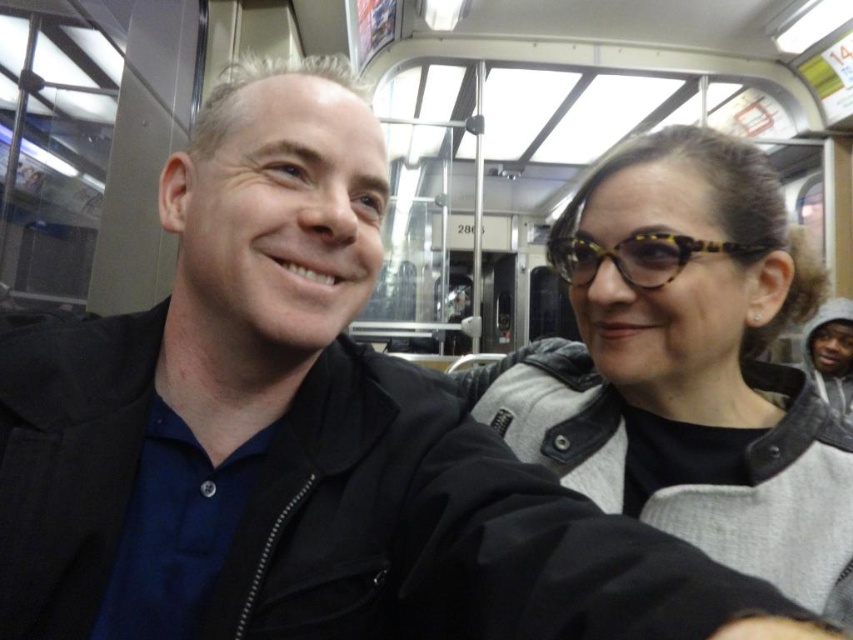
Consider the image. Can you confirm if matte black jacket at center is shorter than tortoiseshell acetate goggles at upper right?

No.

Which is behind, point (729, 324) or point (602, 244)?

The point (729, 324) is more distant.

Locate an element on the screen. This screenshot has width=853, height=640. matte black jacket at center is located at coordinates (686, 365).